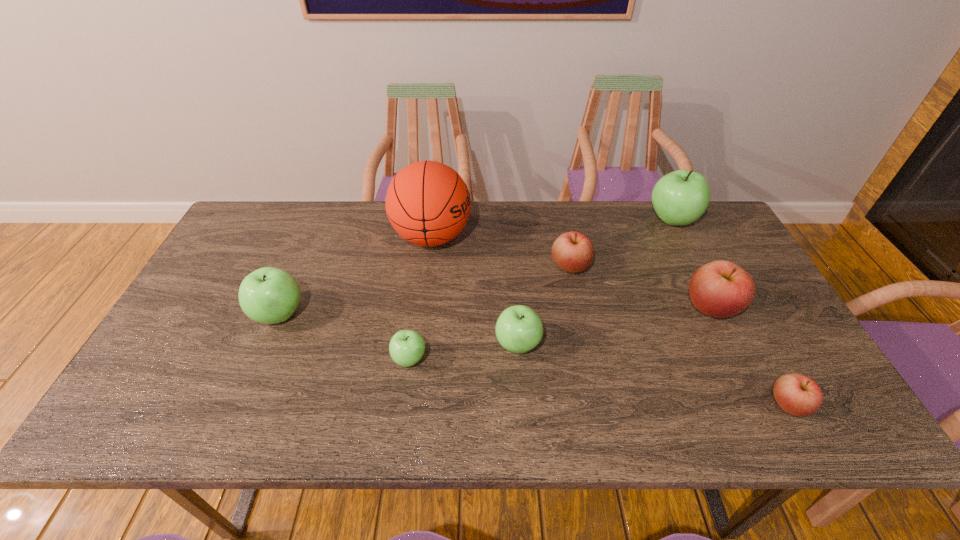
Where is `free location that satisfies the following two spatial constraints: 1. on the back side of the third green apple from right to left; 2. on the right side of the third apple from left to right`? This screenshot has width=960, height=540. free location that satisfies the following two spatial constraints: 1. on the back side of the third green apple from right to left; 2. on the right side of the third apple from left to right is located at coordinates (412, 345).

Image resolution: width=960 pixels, height=540 pixels. Find the location of `free space that satisfies the following two spatial constraints: 1. on the back side of the second farthest red apple; 2. on the side with logo of the basketball`. free space that satisfies the following two spatial constraints: 1. on the back side of the second farthest red apple; 2. on the side with logo of the basketball is located at coordinates (677, 237).

This screenshot has width=960, height=540. I want to click on vacant area in the image that satisfies the following two spatial constraints: 1. on the side with logo of the tallest object; 2. on the front side of the third green apple from right to left, so click(417, 359).